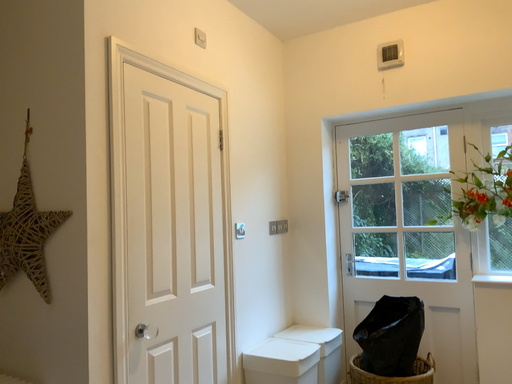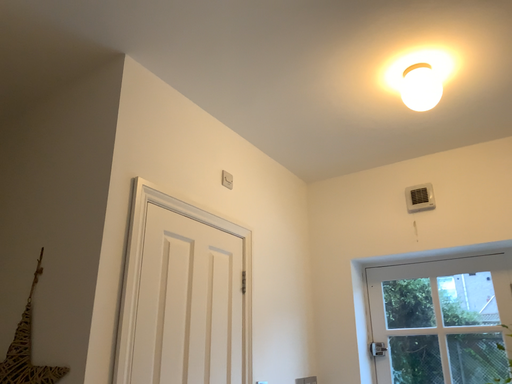
Question: Which way did the camera rotate in the video?

Choices:
 (A) rotated upward
 (B) rotated downward

Answer: (A)